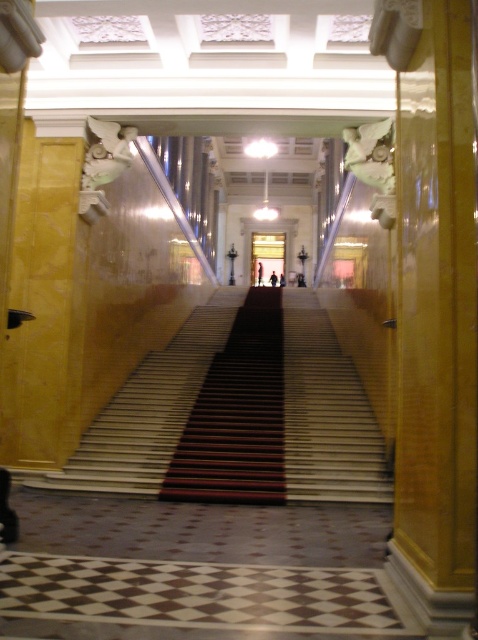
Based on the photo, you are standing at the entrance of this grand space and want to walk towards the red carpet at the top of the stairs. Which direction should you move relative to the point marked at coordinate point (326, 413)?

The point marked at coordinate point (326, 413) corresponds to the polished marble stairs at center. To reach the red carpet at the top of the stairs, you should move upwards from this point.

You are standing at the base of the staircase in this grand interior. You need to walk up the polished marble stairs at center to reach the red carpet at the top. Approximately how many steps will you climb before reaching the top?

There are approximately 25 steps in the polished marble stairs at center, so you will climb around 25 steps to reach the top.

You are standing at the entrance of the grand building and want to reach the red carpet at the top of the staircase. According to the image, where exactly are the polished marble stairs at center located in relation to your position?

The polished marble stairs at center are located at coordinates point [326,413], so they are positioned to your right and slightly ahead, guiding you toward the red carpet at the top.